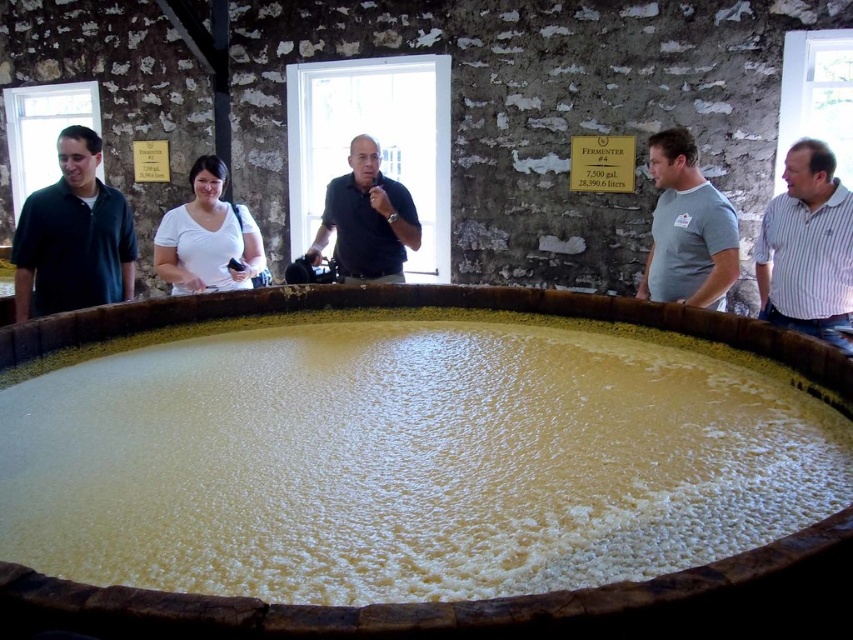
Can you confirm if yellowish creamy substance at center is positioned below white matte shirt at center?

Yes, yellowish creamy substance at center is below white matte shirt at center.

Can you confirm if yellowish creamy substance at center is bigger than white matte shirt at center?

Correct, yellowish creamy substance at center is larger in size than white matte shirt at center.

Between point (558, 454) and point (180, 220), which one is positioned in front?

Point (558, 454)

This screenshot has width=853, height=640. In order to click on yellowish creamy substance at center in this screenshot , I will do `click(405, 456)`.

How far apart are gray cotton t-shirt at center and white matte shirt at center?

A distance of 2.24 meters exists between gray cotton t-shirt at center and white matte shirt at center.

From the picture: Who is more distant from viewer, (x=685, y=161) or (x=184, y=260)?

Point (x=184, y=260)

You are a GUI agent. You are given a task and a screenshot of the screen. Output one action in this format:
    pyautogui.click(x=<x>, y=<y>)
    Task: Click on the gray cotton t-shirt at center
    The image size is (853, 640).
    Given the screenshot: What is the action you would take?
    pyautogui.click(x=688, y=228)

Can you confirm if striped cotton shirt at right is positioned to the right of gray cotton t-shirt at center?

Indeed, striped cotton shirt at right is positioned on the right side of gray cotton t-shirt at center.

Is point (810, 252) positioned after point (654, 138)?

No, (810, 252) is in front of (654, 138).

Locate an element on the screen. striped cotton shirt at right is located at coordinates (807, 248).